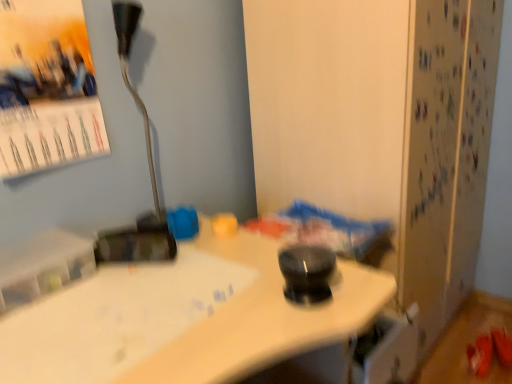
Question: Is metallic silver lamp at upper left situated inside matte paper poster at upper left or outside?

Choices:
 (A) outside
 (B) inside

Answer: (A)

Question: From a real-world perspective, relative to matte paper poster at upper left, is metallic silver lamp at upper left vertically above or below?

Choices:
 (A) below
 (B) above

Answer: (A)

Question: Looking at the image, does metallic silver lamp at upper left seem bigger or smaller compared to matte paper poster at upper left?

Choices:
 (A) big
 (B) small

Answer: (B)

Question: Considering the positions of matte paper poster at upper left and metallic silver lamp at upper left in the image, is matte paper poster at upper left taller or shorter than metallic silver lamp at upper left?

Choices:
 (A) tall
 (B) short

Answer: (B)

Question: Is matte paper poster at upper left wider or thinner than metallic silver lamp at upper left?

Choices:
 (A) wide
 (B) thin

Answer: (B)

Question: Considering the positions of point (60, 92) and point (101, 261), is point (60, 92) closer or farther from the camera than point (101, 261)?

Choices:
 (A) farther
 (B) closer

Answer: (A)

Question: In the image, is matte paper poster at upper left positioned in front of or behind metallic silver lamp at upper left?

Choices:
 (A) front
 (B) behind

Answer: (A)